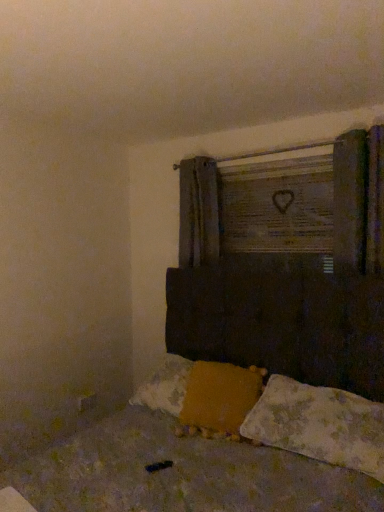
The height and width of the screenshot is (512, 384). Describe the element at coordinates (319, 425) in the screenshot. I see `fluffy white pillow at lower right, the 2th pillow viewed from the left` at that location.

Identify the location of fluffy white pillow at lower right, the 1th pillow from the right. The width and height of the screenshot is (384, 512). (319, 425).

This screenshot has height=512, width=384. I want to click on yellow fabric pillow at lower center, marked as the second pillow in a right-to-left arrangement, so click(219, 398).

Image resolution: width=384 pixels, height=512 pixels. What do you see at coordinates (278, 207) in the screenshot?
I see `wooden sign at upper center` at bounding box center [278, 207].

You are a GUI agent. You are given a task and a screenshot of the screen. Output one action in this format:
    pyautogui.click(x=<x>, y=<y>)
    Task: Click on the wooden sign at upper center
    This screenshot has width=384, height=512.
    Given the screenshot: What is the action you would take?
    pyautogui.click(x=278, y=207)

This screenshot has width=384, height=512. In order to click on fluffy white pillow at lower right, the 1th pillow from the right in this screenshot , I will do `click(319, 425)`.

Looking at this image, between fluffy white pillow at lower right, the 2th pillow viewed from the left, and dark brown wooden bed at center, which one has more height?

With more height is dark brown wooden bed at center.

From the image's perspective, is fluffy white pillow at lower right, the 1th pillow from the right, on top of dark brown wooden bed at center?

Yes, from the image's perspective, fluffy white pillow at lower right, the 1th pillow from the right, is above dark brown wooden bed at center.

Can you confirm if fluffy white pillow at lower right, the 1th pillow from the right, is wider than dark brown wooden bed at center?

In fact, fluffy white pillow at lower right, the 1th pillow from the right, might be narrower than dark brown wooden bed at center.

From the image's perspective, between wooden sign at upper center and dark brown wooden bed at center, which one is located above?

wooden sign at upper center appears higher in the image.

Between point (306, 234) and point (149, 446), which one is positioned in front?

Point (149, 446)

Choose the correct answer: Is wooden sign at upper center inside dark brown wooden bed at center or outside it?

wooden sign at upper center is not inside dark brown wooden bed at center, it's outside.

Find the location of a particular element. This screenshot has height=512, width=384. window frame on the right of yellow fabric pillow at lower center, marked as the second pillow in a right-to-left arrangement is located at coordinates (278, 207).

Is wooden sign at upper center oriented towards yellow fabric pillow at lower center, which is counted as the 1th pillow, starting from the left?

No.

From a real-world perspective, who is located higher, wooden sign at upper center or yellow fabric pillow at lower center, marked as the second pillow in a right-to-left arrangement?

wooden sign at upper center, from a real-world perspective.

From the picture: Is wooden sign at upper center bigger or smaller than yellow fabric pillow at lower center, marked as the second pillow in a right-to-left arrangement?

wooden sign at upper center is smaller than yellow fabric pillow at lower center, marked as the second pillow in a right-to-left arrangement.

Can you confirm if yellow fabric pillow at lower center, which is counted as the 1th pillow, starting from the left, is thinner than fluffy white pillow at lower right, the 1th pillow from the right?

Indeed, yellow fabric pillow at lower center, which is counted as the 1th pillow, starting from the left, has a lesser width compared to fluffy white pillow at lower right, the 1th pillow from the right.

Find the location of a particular element. pillow positioned vertically above the fluffy white pillow at lower right, the 1th pillow from the right (from a real-world perspective) is located at coordinates (219, 398).

Is yellow fabric pillow at lower center, which is counted as the 1th pillow, starting from the left, positioned before fluffy white pillow at lower right, the 2th pillow viewed from the left?

That is False.

Is yellow fabric pillow at lower center, which is counted as the 1th pillow, starting from the left, oriented towards fluffy white pillow at lower right, the 1th pillow from the right?

No, yellow fabric pillow at lower center, which is counted as the 1th pillow, starting from the left, does not turn towards fluffy white pillow at lower right, the 1th pillow from the right.

In the image, is yellow fabric pillow at lower center, marked as the second pillow in a right-to-left arrangement, on the left side or the right side of wooden sign at upper center?

In the image, yellow fabric pillow at lower center, marked as the second pillow in a right-to-left arrangement, appears on the left side of wooden sign at upper center.

Looking at the image, does yellow fabric pillow at lower center, marked as the second pillow in a right-to-left arrangement, seem bigger or smaller compared to wooden sign at upper center?

Considering their sizes, yellow fabric pillow at lower center, marked as the second pillow in a right-to-left arrangement, takes up more space than wooden sign at upper center.

Which object is wider, yellow fabric pillow at lower center, which is counted as the 1th pillow, starting from the left, or wooden sign at upper center?

yellow fabric pillow at lower center, which is counted as the 1th pillow, starting from the left.

Which of these two, yellow fabric pillow at lower center, which is counted as the 1th pillow, starting from the left, or wooden sign at upper center, stands shorter?

With less height is yellow fabric pillow at lower center, which is counted as the 1th pillow, starting from the left.

Does dark brown wooden bed at center come in front of fluffy white pillow at lower right, the 1th pillow from the right?

Yes, dark brown wooden bed at center is closer to the viewer.

Measure the distance from dark brown wooden bed at center to fluffy white pillow at lower right, the 1th pillow from the right.

They are 6.80 inches apart.

From a real-world perspective, between dark brown wooden bed at center and fluffy white pillow at lower right, the 1th pillow from the right, who is vertically lower?

In real-world perspective, fluffy white pillow at lower right, the 1th pillow from the right, is lower.

What's the angular difference between dark brown wooden bed at center and fluffy white pillow at lower right, the 2th pillow viewed from the left,'s facing directions?

0.418 degrees separate the facing orientations of dark brown wooden bed at center and fluffy white pillow at lower right, the 2th pillow viewed from the left.

Is dark brown wooden bed at center further to camera compared to yellow fabric pillow at lower center, which is counted as the 1th pillow, starting from the left?

No, it is not.

Between dark brown wooden bed at center and yellow fabric pillow at lower center, which is counted as the 1th pillow, starting from the left, which one has larger size?

Bigger between the two is dark brown wooden bed at center.

From a real-world perspective, is dark brown wooden bed at center physically above yellow fabric pillow at lower center, which is counted as the 1th pillow, starting from the left?

Incorrect, from a real-world perspective, dark brown wooden bed at center is lower than yellow fabric pillow at lower center, which is counted as the 1th pillow, starting from the left.

Which is further, (73, 510) or (225, 407)?

The point (225, 407) is farther.

The width and height of the screenshot is (384, 512). Find the location of `the 1st pillow behind the dark brown wooden bed at center`. the 1st pillow behind the dark brown wooden bed at center is located at coordinates (319, 425).

Locate an element on the screen. window frame that is above the dark brown wooden bed at center (from the image's perspective) is located at coordinates (278, 207).

Looking at the image, which one is located further to wooden sign at upper center, fluffy white pillow at lower right, the 2th pillow viewed from the left, or dark brown wooden bed at center?

Based on the image, dark brown wooden bed at center appears to be further to wooden sign at upper center.

Considering their positions, is yellow fabric pillow at lower center, marked as the second pillow in a right-to-left arrangement, positioned closer to dark brown wooden bed at center than wooden sign at upper center?

yellow fabric pillow at lower center, marked as the second pillow in a right-to-left arrangement.

Looking at the image, which one is located further to yellow fabric pillow at lower center, which is counted as the 1th pillow, starting from the left, dark brown wooden bed at center or wooden sign at upper center?

Based on the image, wooden sign at upper center appears to be further to yellow fabric pillow at lower center, which is counted as the 1th pillow, starting from the left.

Considering their positions, is dark brown wooden bed at center positioned closer to yellow fabric pillow at lower center, marked as the second pillow in a right-to-left arrangement, than fluffy white pillow at lower right, the 1th pillow from the right?

Based on the image, dark brown wooden bed at center appears to be nearer to yellow fabric pillow at lower center, marked as the second pillow in a right-to-left arrangement.

Based on their spatial positions, is wooden sign at upper center or fluffy white pillow at lower right, the 1th pillow from the right, further from dark brown wooden bed at center?

The object further to dark brown wooden bed at center is wooden sign at upper center.

From the image, which object appears to be farther from wooden sign at upper center, yellow fabric pillow at lower center, marked as the second pillow in a right-to-left arrangement, or dark brown wooden bed at center?

Among the two, dark brown wooden bed at center is located further to wooden sign at upper center.

Which object lies nearer to the anchor point wooden sign at upper center, dark brown wooden bed at center or fluffy white pillow at lower right, the 1th pillow from the right?

Based on the image, fluffy white pillow at lower right, the 1th pillow from the right, appears to be nearer to wooden sign at upper center.

From the image, which object appears to be nearer to yellow fabric pillow at lower center, marked as the second pillow in a right-to-left arrangement, fluffy white pillow at lower right, the 1th pillow from the right, or dark brown wooden bed at center?

dark brown wooden bed at center is positioned closer to the anchor yellow fabric pillow at lower center, marked as the second pillow in a right-to-left arrangement.

Identify the location of pillow between wooden sign at upper center and fluffy white pillow at lower right, the 2th pillow viewed from the left, from top to bottom. coord(219,398).

Image resolution: width=384 pixels, height=512 pixels. Find the location of `pillow between dark brown wooden bed at center and yellow fabric pillow at lower center, marked as the second pillow in a right-to-left arrangement, from front to back`. pillow between dark brown wooden bed at center and yellow fabric pillow at lower center, marked as the second pillow in a right-to-left arrangement, from front to back is located at coordinates (319, 425).